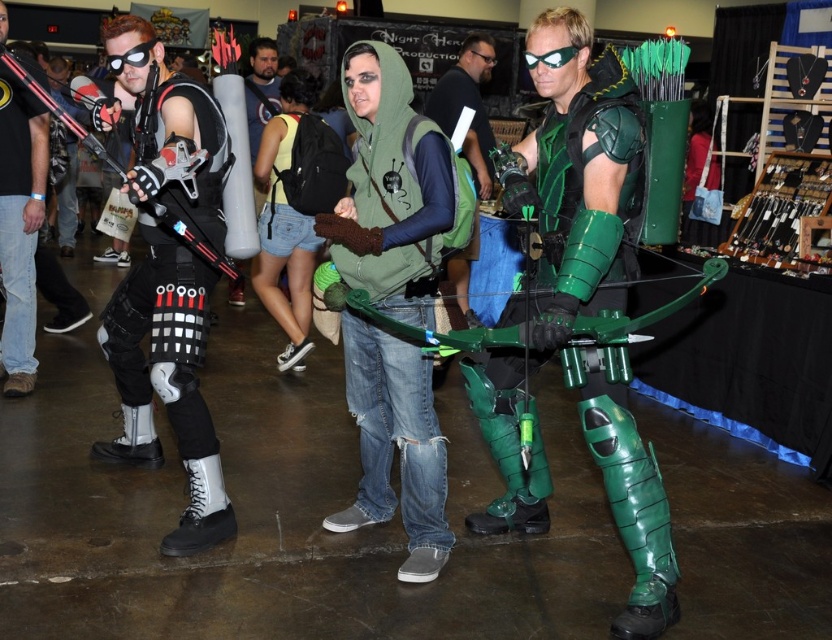
You are a photographer at the convention and need to position a spotlight at the center of the image. The spotlight can only illuminate objects within a 0.2 radius. Will the green matte armor at center be illuminated by the spotlight?

The green matte armor at center is located at point (560,240). The center of the image is at point (416,320). The distance between these points is sqrt. Since the spotlight has a radius of 0.2, the green matte armor at center is outside the spotlight radius and will not be illuminated.

You are a photographer at the event and need to capture a photo of both the green matte armor at center and the green knitted vest at center. Which one should you focus on first to ensure it appears in the foreground of the photo?

You should focus on the green matte armor at center first because it is positioned in front of the green knitted vest at center, making it naturally appear in the foreground.

You are at a convention and want to find the green knitted vest at center. The convention map shows a point at coordinates (390, 189). Is this point the correct location for the green knitted vest at center?

Yes, the point at (390, 189) corresponds to the green knitted vest at center, so this is the correct location.